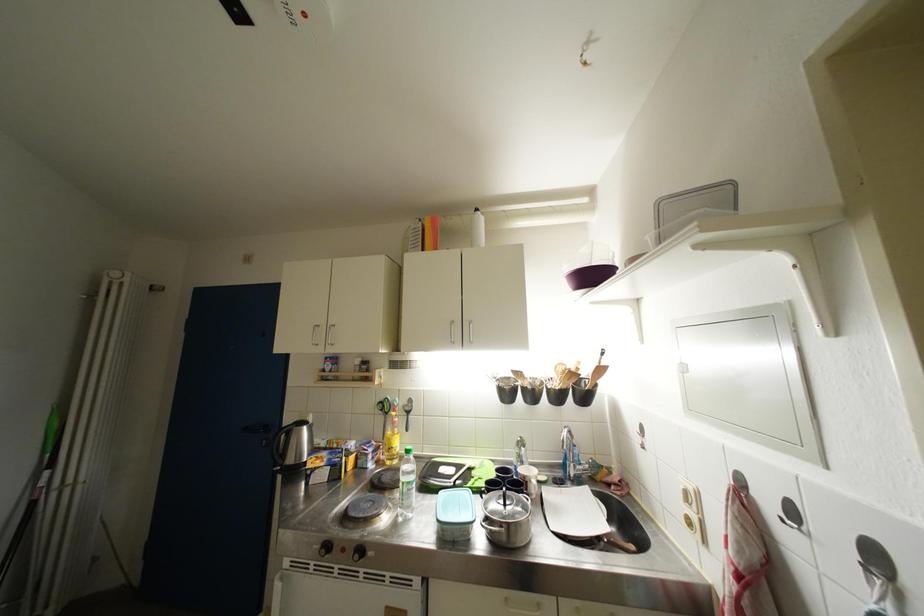
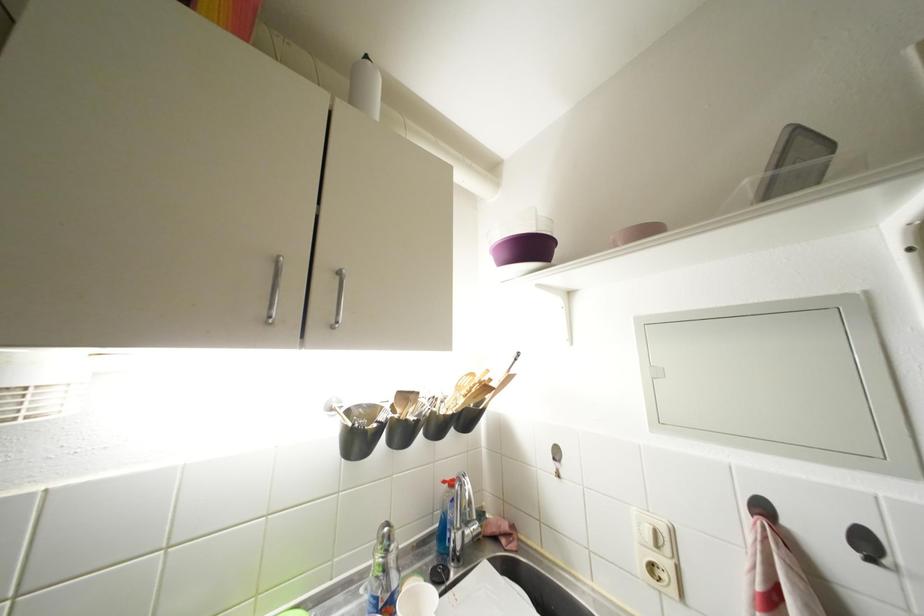
Question: Based on the continuous images, in which direction is the camera rotating? Reply with the corresponding letter.

Choices:
 (A) Left
 (B) Right
 (C) Up
 (D) Down

Answer: (B)